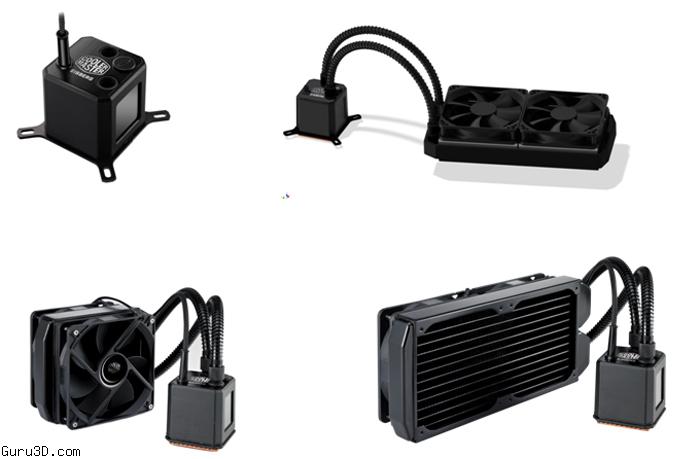
At what (x,y) coordinates should I click in order to perform the action: click on dual fan. Please return your answer as a coordinate pair (x, y). Looking at the image, I should click on (561, 128), (491, 115).